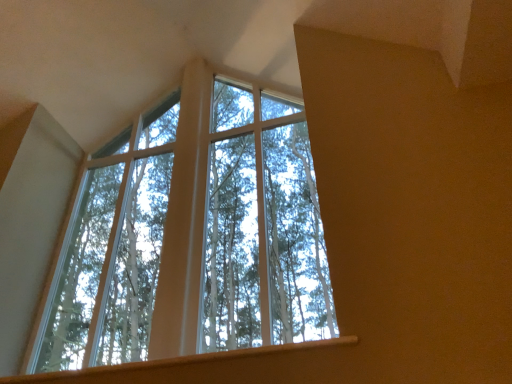
Question: Considering their positions, is clear glass window at center located in front of or behind smooth wood window sill at lower center?

Choices:
 (A) behind
 (B) front

Answer: (A)

Question: Is point (144, 327) closer or farther from the camera than point (266, 347)?

Choices:
 (A) closer
 (B) farther

Answer: (B)

Question: From a real-world perspective, is clear glass window at center above or below smooth wood window sill at lower center?

Choices:
 (A) above
 (B) below

Answer: (A)

Question: Would you say smooth wood window sill at lower center is inside or outside clear glass window at center?

Choices:
 (A) outside
 (B) inside

Answer: (A)

Question: Looking at the image, does smooth wood window sill at lower center seem bigger or smaller compared to clear glass window at center?

Choices:
 (A) big
 (B) small

Answer: (B)

Question: In terms of width, does smooth wood window sill at lower center look wider or thinner when compared to clear glass window at center?

Choices:
 (A) thin
 (B) wide

Answer: (B)

Question: Is point (329, 347) positioned closer to the camera than point (275, 190)?

Choices:
 (A) farther
 (B) closer

Answer: (B)